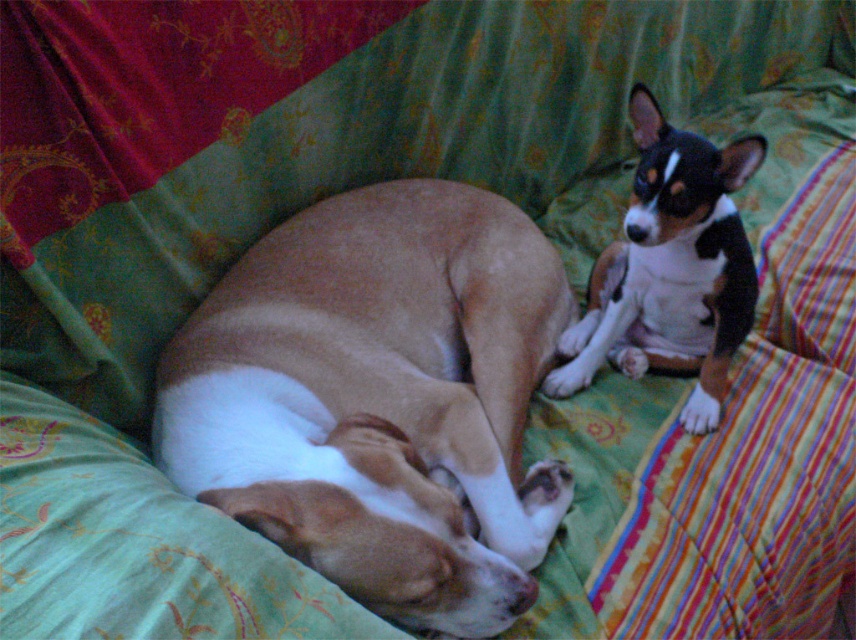
Question: Is brown matte dog at center to the left of black and white fur at upper right from the viewer's perspective?

Choices:
 (A) yes
 (B) no

Answer: (A)

Question: Does brown matte dog at center appear over black and white fur at upper right?

Choices:
 (A) no
 (B) yes

Answer: (A)

Question: Which point appears closest to the camera in this image?

Choices:
 (A) (589, 278)
 (B) (414, 198)

Answer: (B)

Question: Is brown matte dog at center wider than black and white fur at upper right?

Choices:
 (A) no
 (B) yes

Answer: (B)